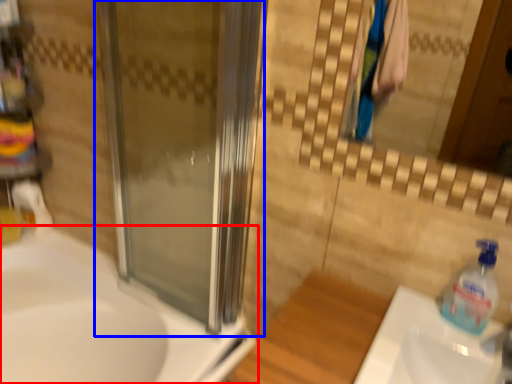
Question: Which point is further to the camera, sink (highlighted by a red box) or screen door (highlighted by a blue box)?

Choices:
 (A) sink
 (B) screen door

Answer: (A)